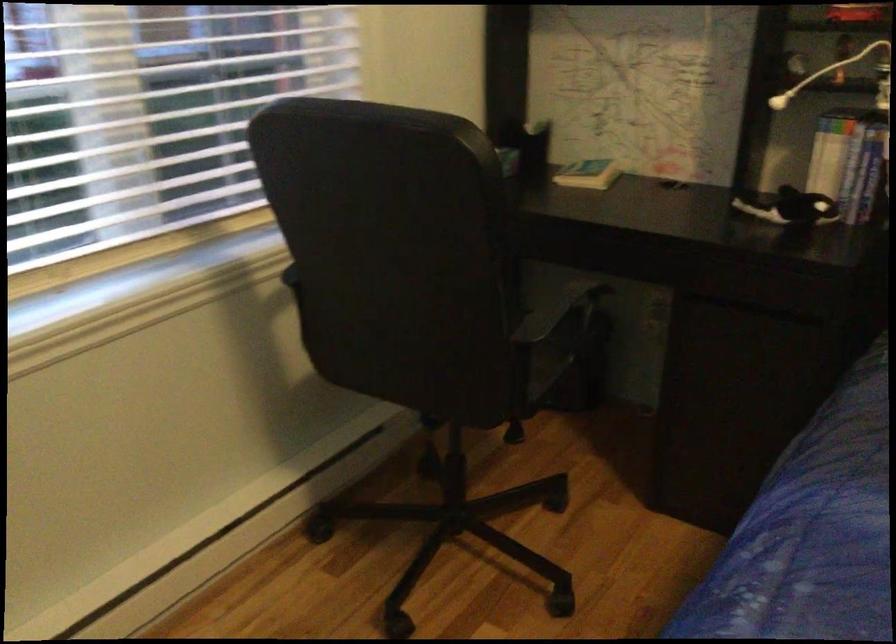
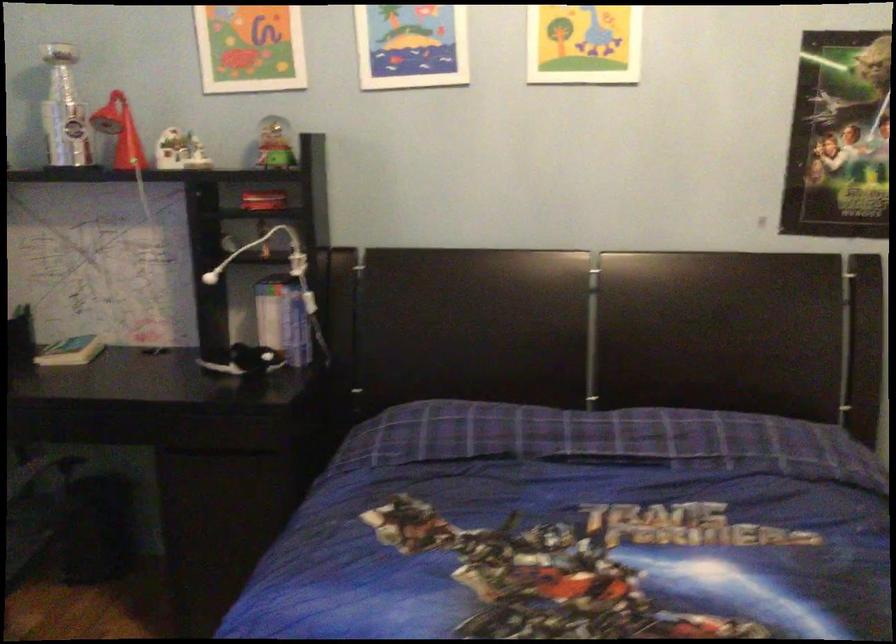
Question: The images are taken continuously from a first-person perspective. In which direction is your viewpoint rotating?

Choices:
 (A) Left
 (B) Right
 (C) Up
 (D) Down

Answer: (B)